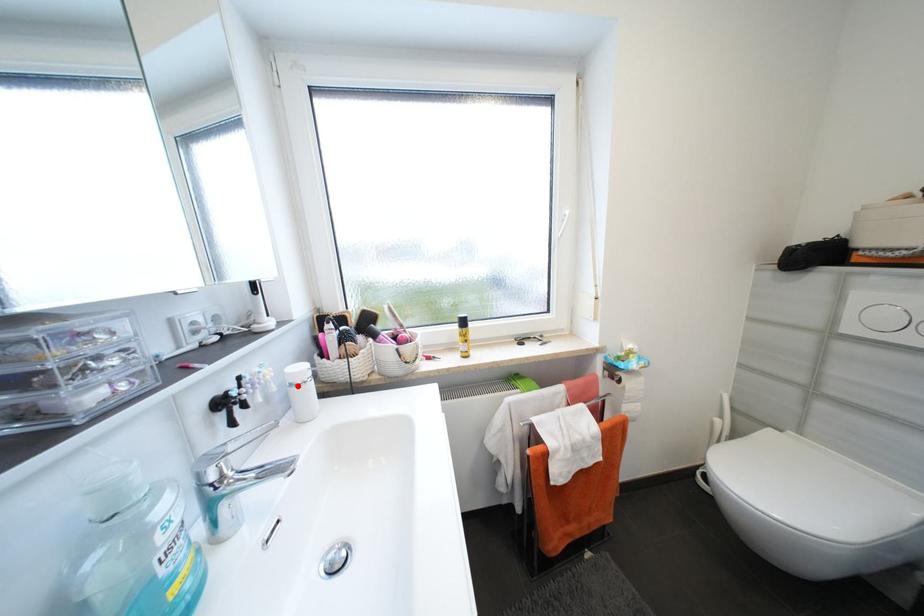
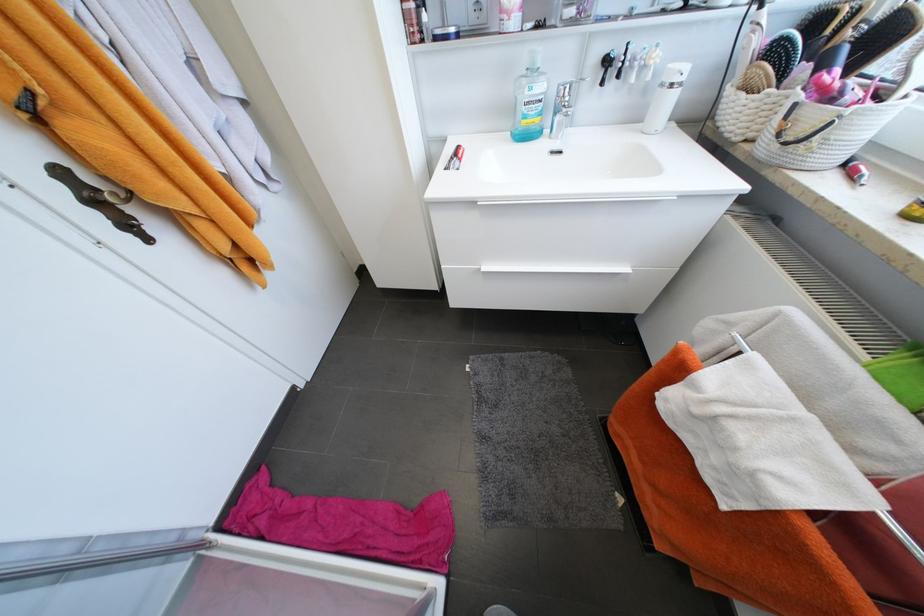
In the second image, find the point that corresponds to the highlighted location in the first image.

(667, 86)